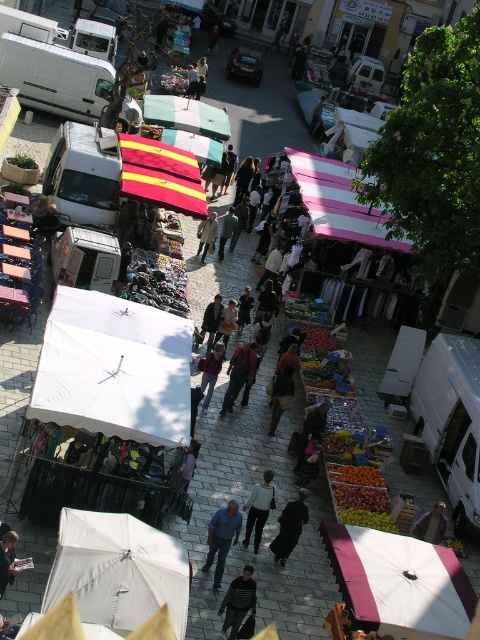
Question: Which of these objects is positioned farthest from the white matte umbrella at lower left?

Choices:
 (A) pink striped canopy at center-right
 (B) yellow striped canopy at center

Answer: (B)

Question: Is yellow striped fabric canopy at center further to camera compared to dark gray jacket at center?

Choices:
 (A) no
 (B) yes

Answer: (B)

Question: Which of the following is the closest to the observer?

Choices:
 (A) green fabric umbrella at center
 (B) dark fabric bag at center
 (C) blue denim jeans at center
 (D) light brown leather jacket at center

Answer: (C)

Question: Can you confirm if pink striped canopy at center-right is positioned to the right of dark blue jeans at center?

Choices:
 (A) yes
 (B) no

Answer: (A)

Question: From the image, what is the correct spatial relationship of pink striped canopy at center-right in relation to denim jacket at center?

Choices:
 (A) below
 (B) above

Answer: (B)

Question: Based on their relative distances, which object is nearer to the maroon fabric umbrella at lower right?

Choices:
 (A) green fabric umbrella at center
 (B) dark fabric bag at center

Answer: (B)